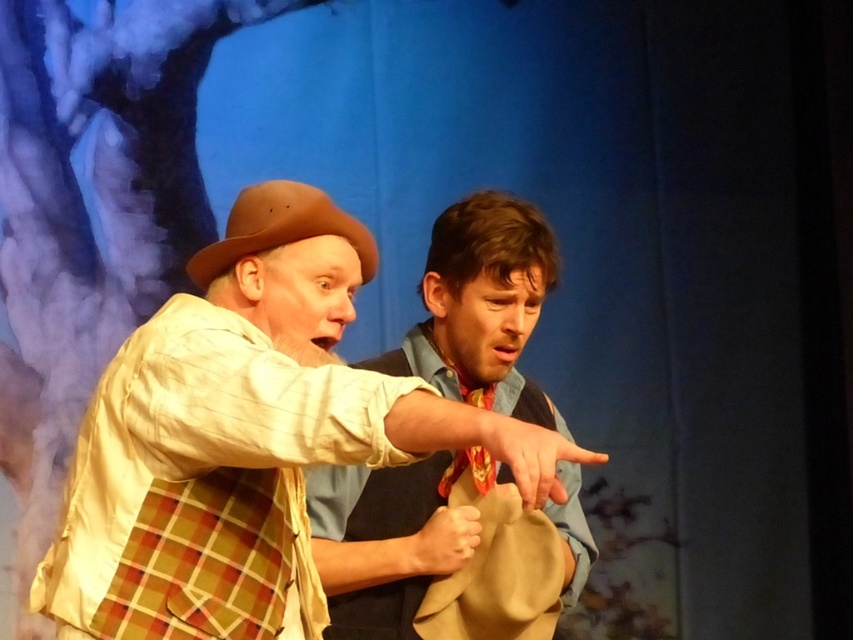
You are a costume designer measuring the distance between two hats for a scene. The matte brown hat at center and the brown felt cowboy hat at left are part of the actors costumes. Can you confirm if the distance between them is sufficient for a closeup shot requiring at least 12 inches between props?

The matte brown hat at center and the brown felt cowboy hat at left are 11.91 inches apart. Since the required distance is 12 inches, the current spacing is just shy of the requirement by 0.09 inches and would need adjustment to meet the closeup shot requirement.

You are a photographer standing at the camera position. You want to take a closeup shot of the matte brown hat at center. Can you move closer to the hat to get a better shot without exceeding the 3.30 feet distance limit?

The matte brown hat at center and camera are 3.30 feet apart from each other, so you cannot move closer than the current distance of 3.30 feet to get a better shot without exceeding the limit.